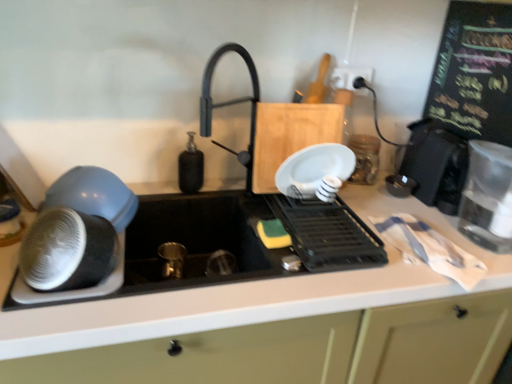
Where is `vacant region in front of black plastic toaster at right, the 4th appliance positioned from the left`? vacant region in front of black plastic toaster at right, the 4th appliance positioned from the left is located at coordinates (428, 221).